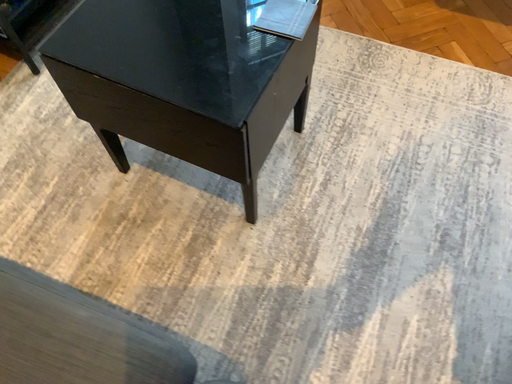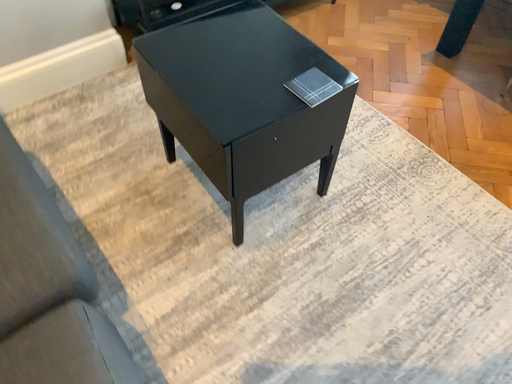
Question: How did the camera likely rotate when shooting the video?

Choices:
 (A) rotated upward
 (B) rotated downward

Answer: (A)